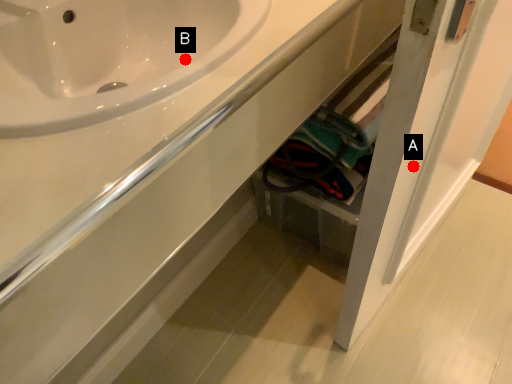
Question: Two points are circled on the image, labeled by A and B beside each circle. Which point appears farthest from the camera in this image?

Choices:
 (A) A is further
 (B) B is further

Answer: (B)